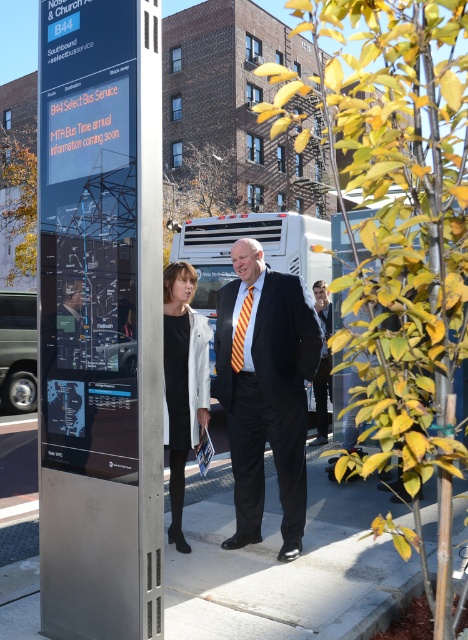
You are a delivery person with a cart that is 1.5 meters wide. You need to pass between the metallic digital display at center and the white matte coat at center to reach the sidewalk. Can your cart fit through the space between them?

The metallic digital display at center is 1.24 meters from the white matte coat at center. Since your cart is 1.5 meters wide, it cannot fit through the space between them as the distance is narrower than the cart.

You are a pedestrian waiting at the bus stop and see the matte black suit at center and the yellow striped tie at center. Which object is positioned lower from the ground?

The matte black suit at center is positioned below the yellow striped tie at center, so it is lower from the ground.

You are standing at the bus stop and want to find the person wearing the matte black suit at center. According to the scene description, where should you look relative to the digital display board mounted on a metal pole?

The matte black suit at center is located at point coordinates (265, 388), which is to the right side of the digital display board mounted on a metal pole.